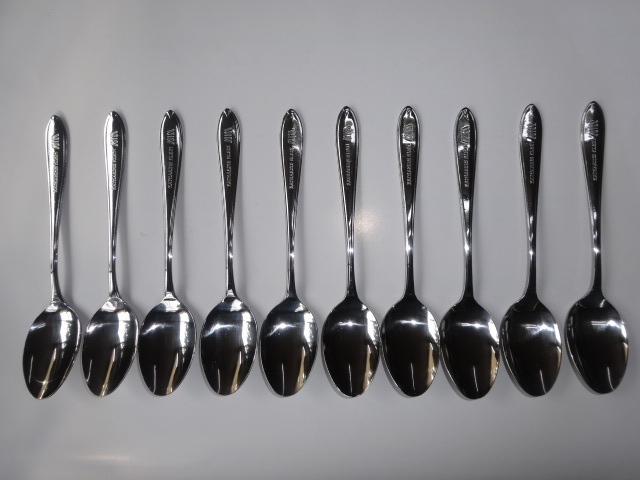
In order to click on spoon handle in this screenshot , I will do `click(52, 163)`, `click(115, 155)`, `click(169, 153)`, `click(228, 157)`, `click(349, 152)`, `click(290, 152)`, `click(406, 151)`, `click(467, 156)`, `click(532, 155)`, `click(592, 146)`.